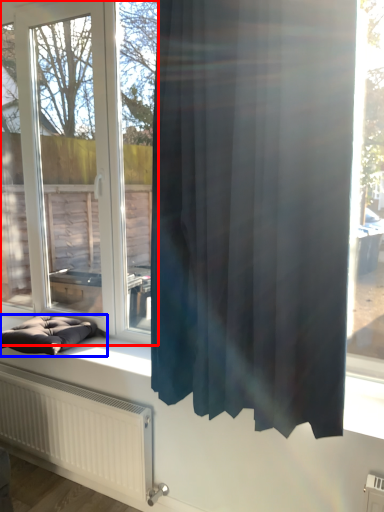
Question: Which object is further to the camera taking this photo, window (highlighted by a red box) or furniture (highlighted by a blue box)?

Choices:
 (A) window
 (B) furniture

Answer: (B)